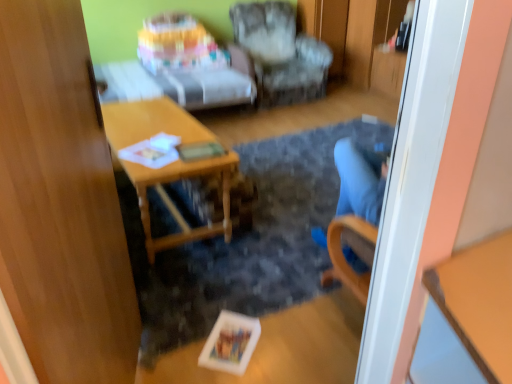
Question: Is pastel fabric couch at upper center not inside transparent wood door at left?

Choices:
 (A) no
 (B) yes

Answer: (B)

Question: Is pastel fabric couch at upper center further to the viewer compared to transparent wood door at left?

Choices:
 (A) no
 (B) yes

Answer: (B)

Question: Considering the relative sizes of pastel fabric couch at upper center and transparent wood door at left in the image provided, is pastel fabric couch at upper center smaller than transparent wood door at left?

Choices:
 (A) no
 (B) yes

Answer: (A)

Question: Is pastel fabric couch at upper center positioned far away from transparent wood door at left?

Choices:
 (A) yes
 (B) no

Answer: (A)

Question: From the image's perspective, is pastel fabric couch at upper center below transparent wood door at left?

Choices:
 (A) yes
 (B) no

Answer: (B)

Question: Is pastel fabric couch at upper center facing away from transparent wood door at left?

Choices:
 (A) yes
 (B) no

Answer: (B)

Question: Can you confirm if transparent wood door at left is shorter than pastel fabric couch at upper center?

Choices:
 (A) no
 (B) yes

Answer: (A)

Question: Does transparent wood door at left have a smaller size compared to pastel fabric couch at upper center?

Choices:
 (A) no
 (B) yes

Answer: (B)

Question: Is transparent wood door at left far from pastel fabric couch at upper center?

Choices:
 (A) no
 (B) yes

Answer: (B)

Question: Is transparent wood door at left wider than pastel fabric couch at upper center?

Choices:
 (A) no
 (B) yes

Answer: (A)

Question: Is transparent wood door at left oriented towards pastel fabric couch at upper center?

Choices:
 (A) no
 (B) yes

Answer: (A)

Question: Does transparent wood door at left have a larger size compared to pastel fabric couch at upper center?

Choices:
 (A) no
 (B) yes

Answer: (A)

Question: Is textured fabric armchair at center surrounded by wooden desk at center?

Choices:
 (A) yes
 (B) no

Answer: (B)